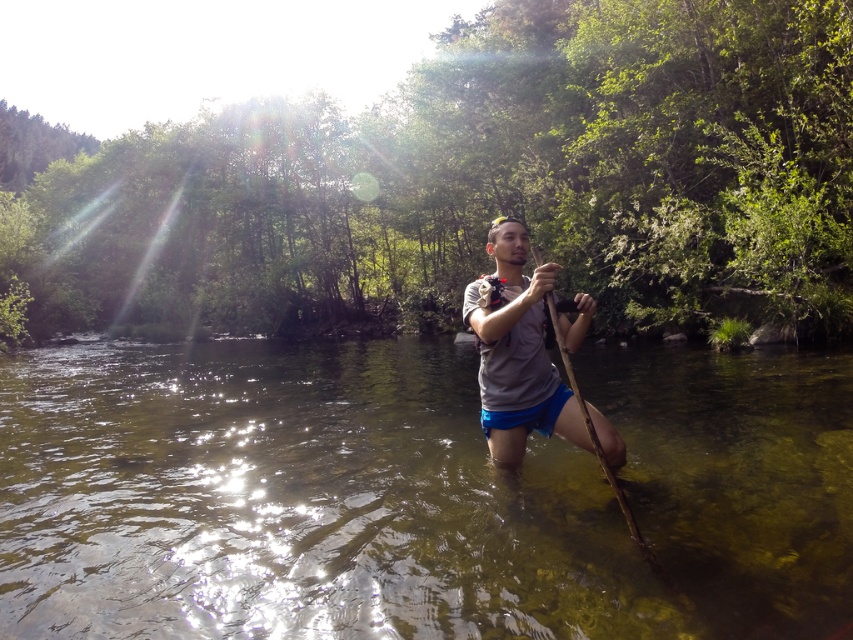
You are a hiker who wants to cross the shallow water to reach the point marked by point (97,467) and point (500,230). Which point is closer to you, the hiker, as you stand on the riverbank?

Point (97,467) is further to the viewer than point (500,230), so the closer point to you is point (500,230).

You are trying to decide whether to wear the gray matte shirt at center or bring the brown wooden paddle at center on a hike. Based on their sizes, which item takes up more space horizontally?

The gray matte shirt at center has a larger width than the brown wooden paddle at center, so the gray matte shirt at center takes up more horizontal space.